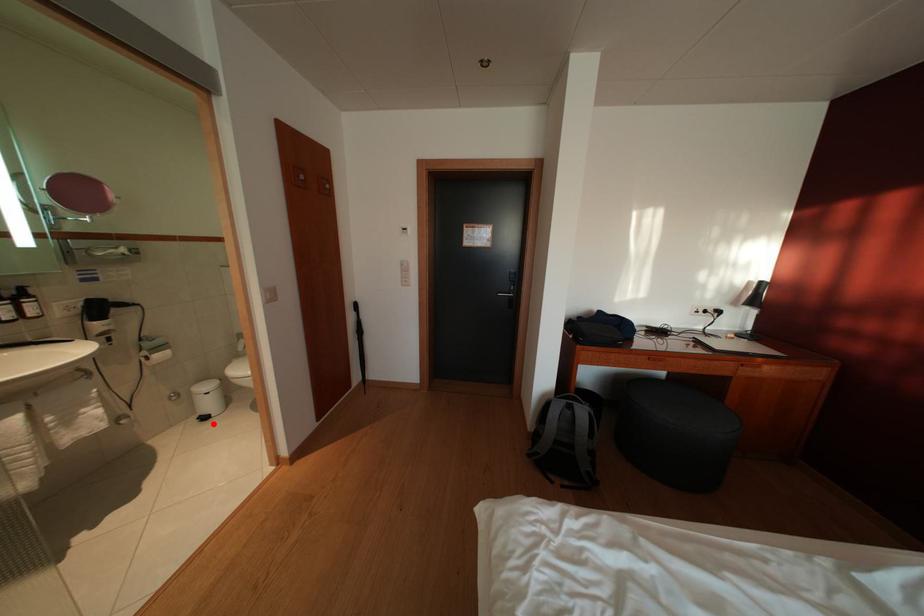
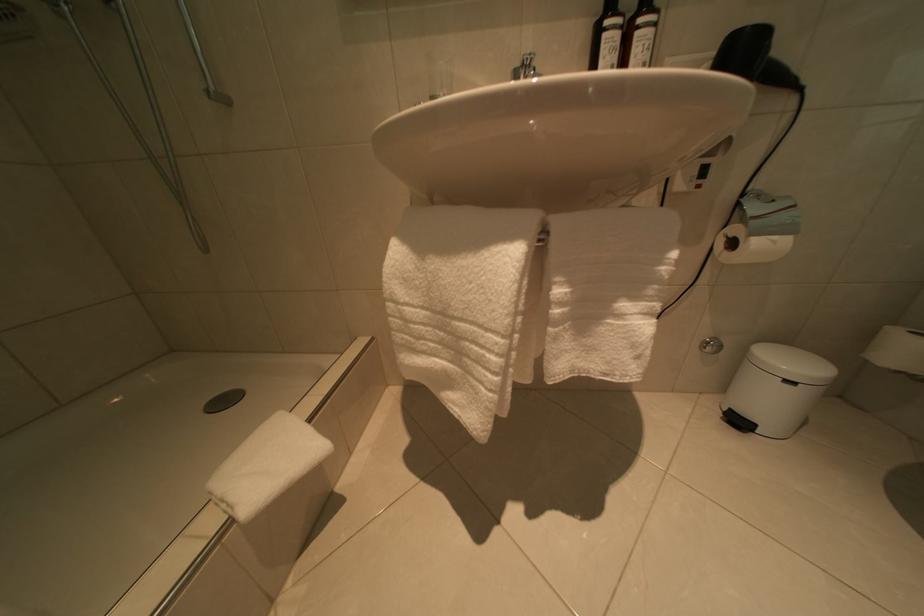
Where in the second image is the point corresponding to the highlighted location from the first image?

(746, 428)